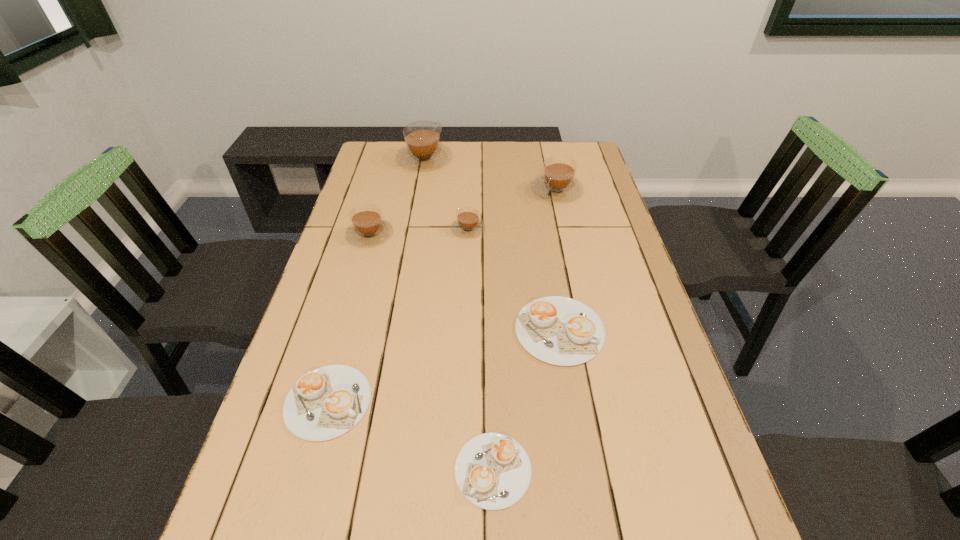
Identify the location of the farthest cappuccino. This screenshot has width=960, height=540. (423, 150).

Identify the location of the tallest cappuccino. coord(423,150).

Where is `the second biggest brown cappuccino`? The height and width of the screenshot is (540, 960). the second biggest brown cappuccino is located at coordinates (558, 183).

Locate an element on the screen. The height and width of the screenshot is (540, 960). the sixth shortest cappuccino is located at coordinates (558, 183).

The image size is (960, 540). I want to click on the third biggest brown cappuccino, so click(x=368, y=228).

Find the location of a particular element. This screenshot has width=960, height=540. the third tallest cappuccino is located at coordinates (368, 228).

Locate an element on the screen. The image size is (960, 540). the third brown cappuccino from left to right is located at coordinates (467, 224).

Identify the location of the smallest brown cappuccino. (467, 224).

Find the location of a particular element. the fifth tallest cappuccino is located at coordinates (558, 330).

Where is `the third shortest object`? The height and width of the screenshot is (540, 960). the third shortest object is located at coordinates (558, 330).